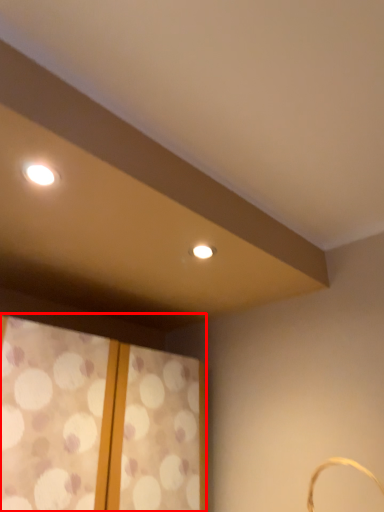
Question: From the image's perspective, where is window (annotated by the red box) located relative to basket?

Choices:
 (A) above
 (B) below

Answer: (B)